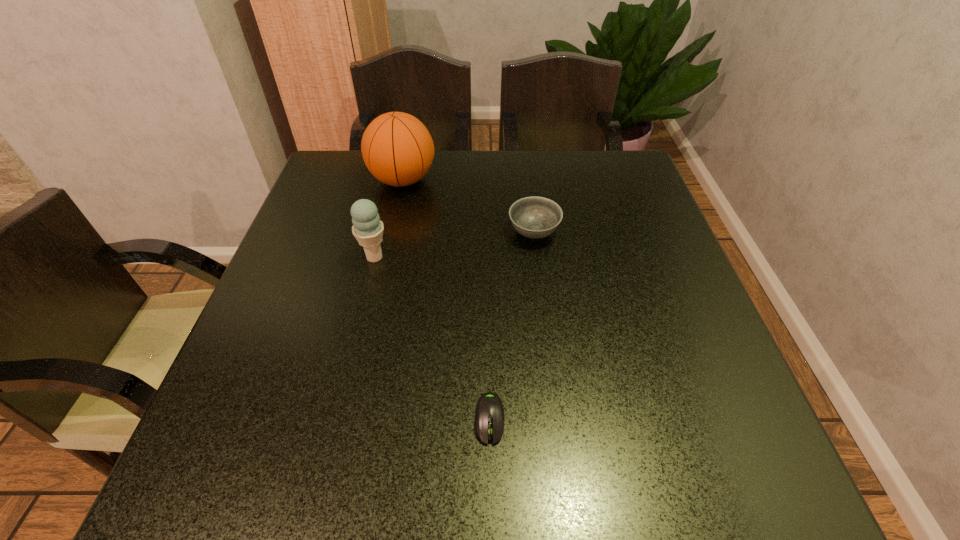
Find the location of a particular element. vacant space located on the wheel side of the shortest object is located at coordinates (492, 491).

Find the location of a particular element. object at the far edge is located at coordinates (398, 150).

The image size is (960, 540). Find the location of `object located at the near edge`. object located at the near edge is located at coordinates (489, 413).

At what (x,y) coordinates should I click in order to perform the action: click on object present at the left edge. Please return your answer as a coordinate pair (x, y). Looking at the image, I should click on (398, 150).

Find the location of a particular element. The image size is (960, 540). object at the far left corner is located at coordinates (398, 150).

Identify the location of free spot at the far edge of the desktop. This screenshot has width=960, height=540. (485, 158).

Where is `vacant space at the near edge of the desktop`? The width and height of the screenshot is (960, 540). vacant space at the near edge of the desktop is located at coordinates (438, 469).

In the image, there is a desktop. Where is `vacant space at the left edge`? The height and width of the screenshot is (540, 960). vacant space at the left edge is located at coordinates (333, 316).

The image size is (960, 540). I want to click on vacant area at the right edge, so click(742, 409).

Identify the location of vacant space at the far left corner. The image size is (960, 540). (359, 160).